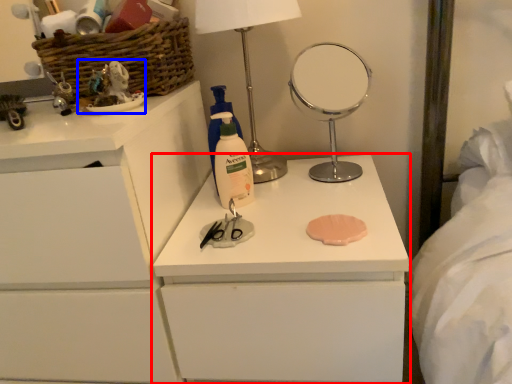
Question: Which point is further to the camera, chest of drawers (highlighted by a red box) or toy (highlighted by a blue box)?

Choices:
 (A) chest of drawers
 (B) toy

Answer: (B)